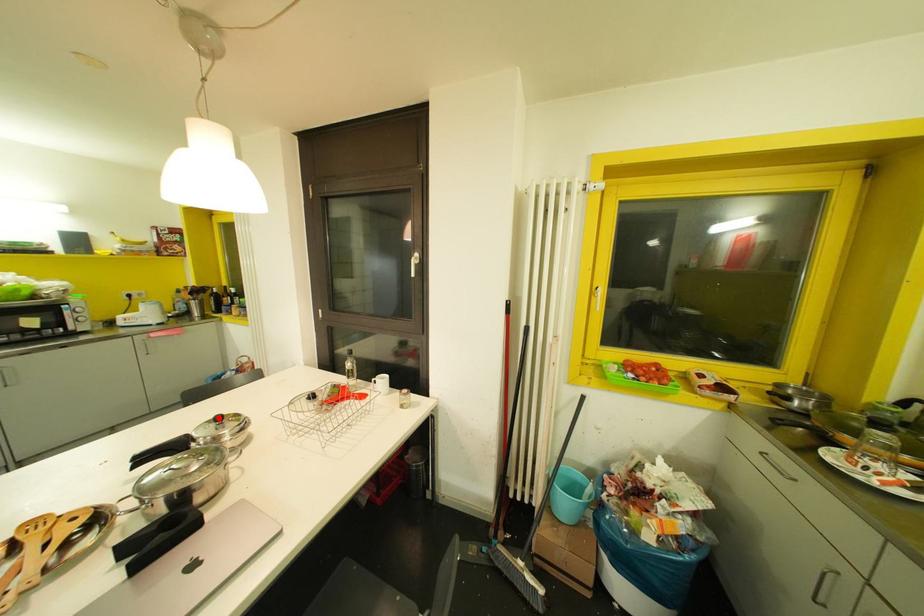
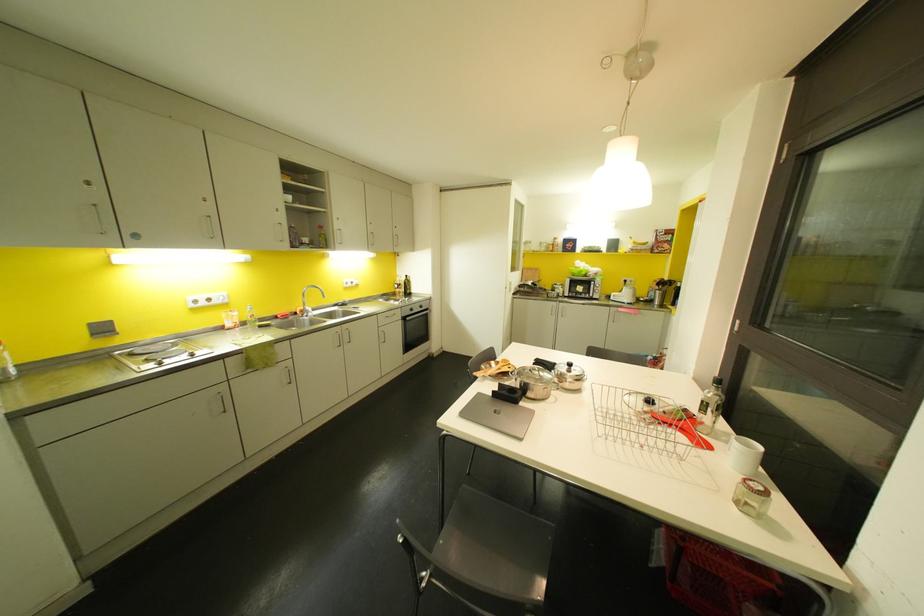
The point at the highlighted location is marked in the first image. Where is the corresponding point in the second image?

(569, 363)